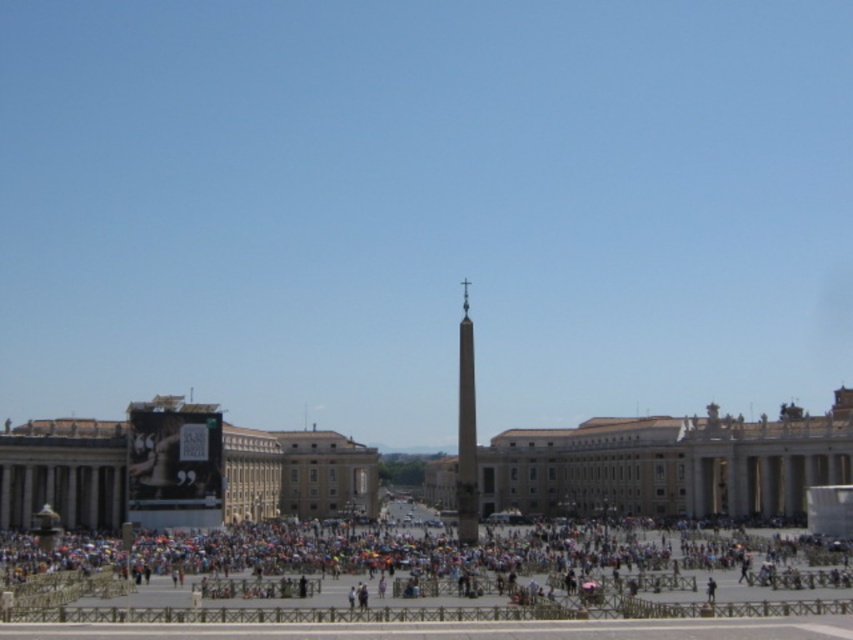
Is point (480, 577) positioned behind point (468, 486)?

No, (480, 577) is in front of (468, 486).

Who is shorter, multicolored fabric crowd at lower center or polished stone obelisk at center?

Standing shorter between the two is multicolored fabric crowd at lower center.

Does point (196, 552) come in front of point (466, 515)?

No, it is not.

The height and width of the screenshot is (640, 853). Find the location of `multicolored fabric crowd at lower center`. multicolored fabric crowd at lower center is located at coordinates (384, 557).